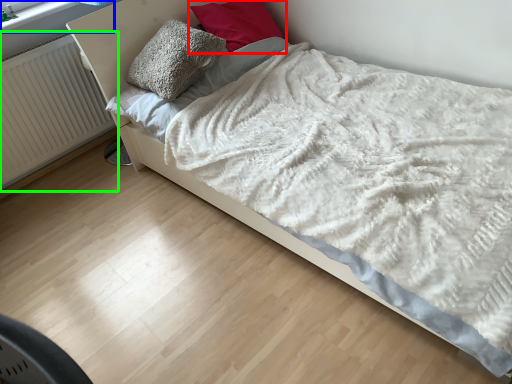
Question: Which is nearer to the pillow (highlighted by a red box)? window frame (highlighted by a blue box) or radiator (highlighted by a green box).

Choices:
 (A) window frame
 (B) radiator

Answer: (A)